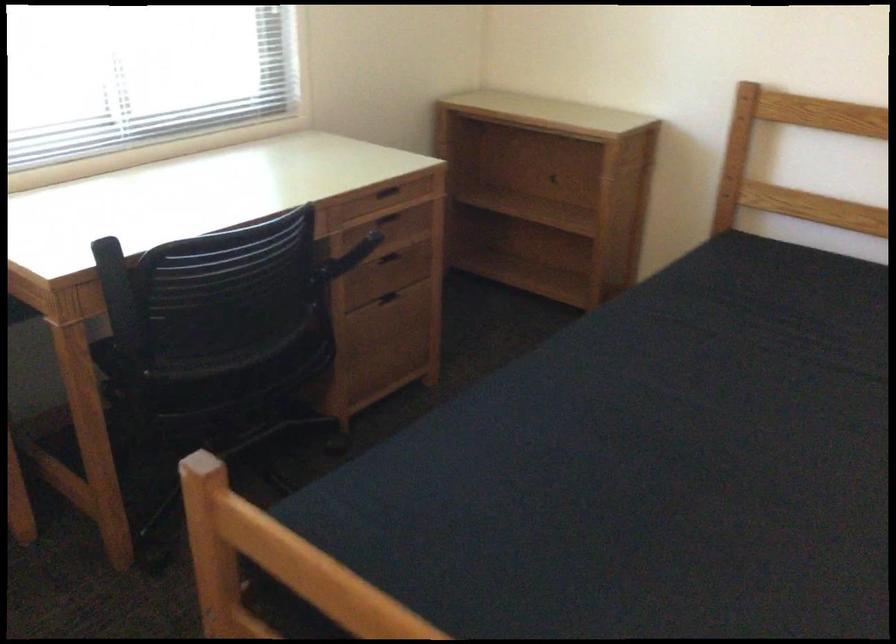
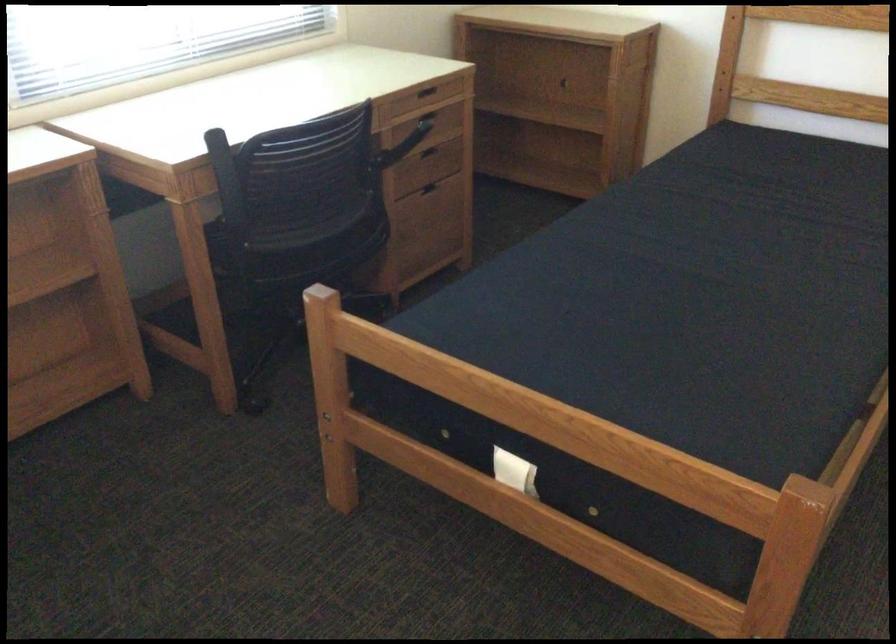
The point at (392, 303) is marked in the first image. Where is the corresponding point in the second image?

(434, 192)